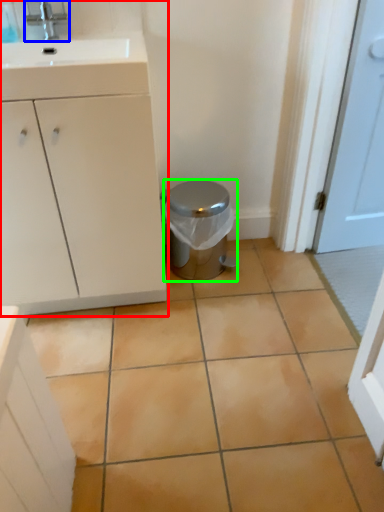
Question: Which object is positioned farthest from bathroom cabinet (highlighted by a red box)? Select from tap (highlighted by a blue box) and potty (highlighted by a green box).

Choices:
 (A) tap
 (B) potty

Answer: (A)